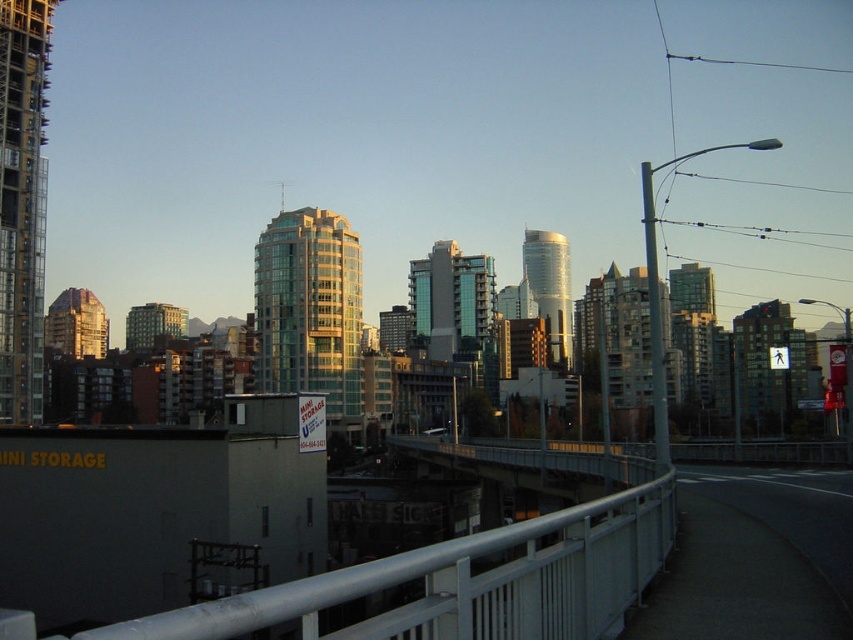
Who is shorter, white metal railing at lower center or metallic gray bridge at center?

white metal railing at lower center

Does white metal railing at lower center lie in front of metallic gray bridge at center?

Yes, white metal railing at lower center is closer to the viewer.

Where is `white metal railing at lower center`? The image size is (853, 640). white metal railing at lower center is located at coordinates (467, 582).